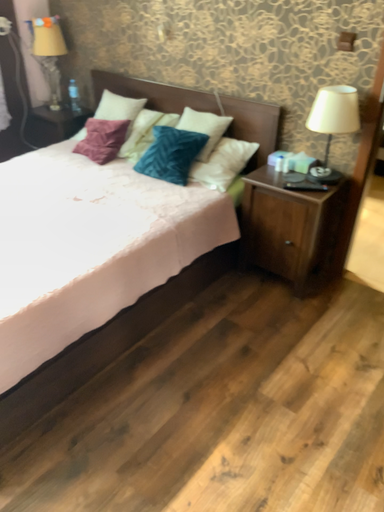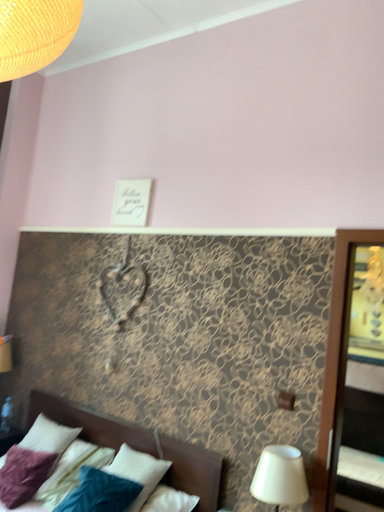
Question: Which way did the camera rotate in the video?

Choices:
 (A) rotated left
 (B) rotated right

Answer: (B)